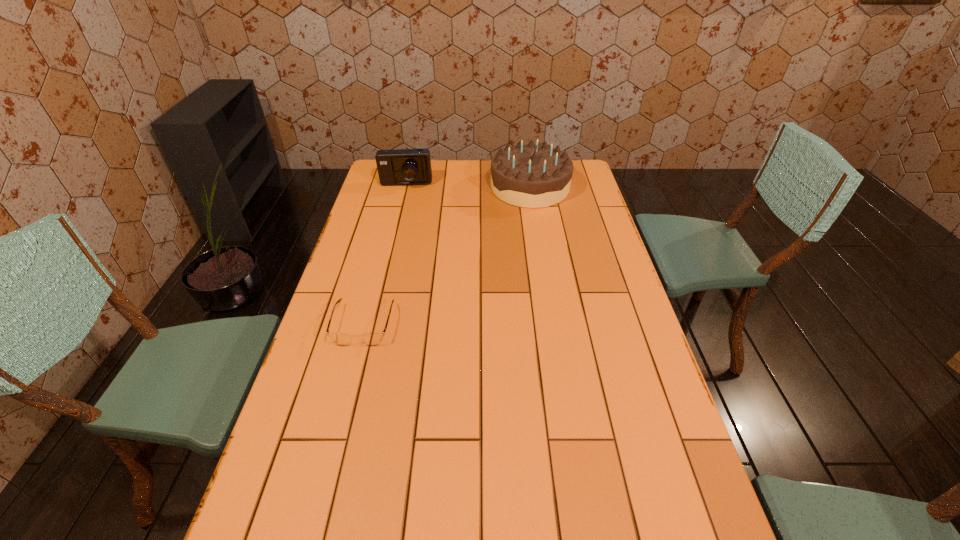
Where is `the rightmost object`? Image resolution: width=960 pixels, height=540 pixels. the rightmost object is located at coordinates (526, 175).

You are a GUI agent. You are given a task and a screenshot of the screen. Output one action in this format:
    pyautogui.click(x=<x>, y=<y>)
    Task: Click on the second tallest object
    The height and width of the screenshot is (540, 960).
    Given the screenshot: What is the action you would take?
    pyautogui.click(x=401, y=166)

Image resolution: width=960 pixels, height=540 pixels. Identify the location of the shortest object. click(x=372, y=339).

You are a GUI agent. You are given a task and a screenshot of the screen. Output one action in this format:
    pyautogui.click(x=<x>, y=<y>)
    Task: Click on the spectacles
    This screenshot has height=540, width=960.
    Given the screenshot: What is the action you would take?
    pyautogui.click(x=372, y=339)

Locate an element on the screen. vacant area situated 0.110m on the front-facing side of the rightmost object is located at coordinates (464, 187).

Locate an element on the screen. vacant space situated 0.050m on the front-facing side of the rightmost object is located at coordinates (478, 187).

What are the coordinates of `free spot located 0.250m on the front-facing side of the rightmost object` in the screenshot? It's located at (430, 187).

Identify the location of vacant area situated 0.060m on the front-facing side of the camera. (402, 199).

The height and width of the screenshot is (540, 960). What are the coordinates of `blank space located 0.130m on the front-facing side of the spectacles` in the screenshot? It's located at (347, 388).

The height and width of the screenshot is (540, 960). I want to click on birthday cake that is at the far edge, so coord(526,175).